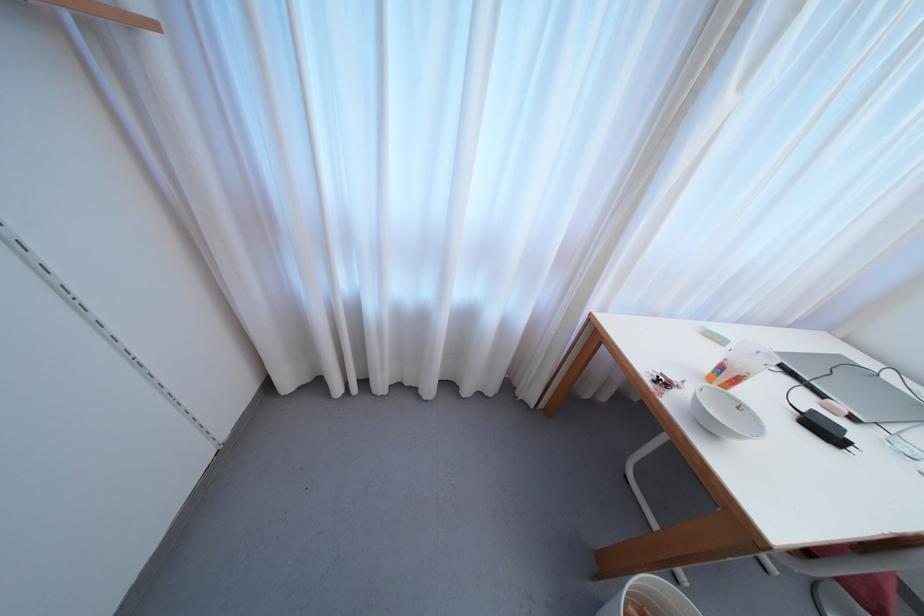
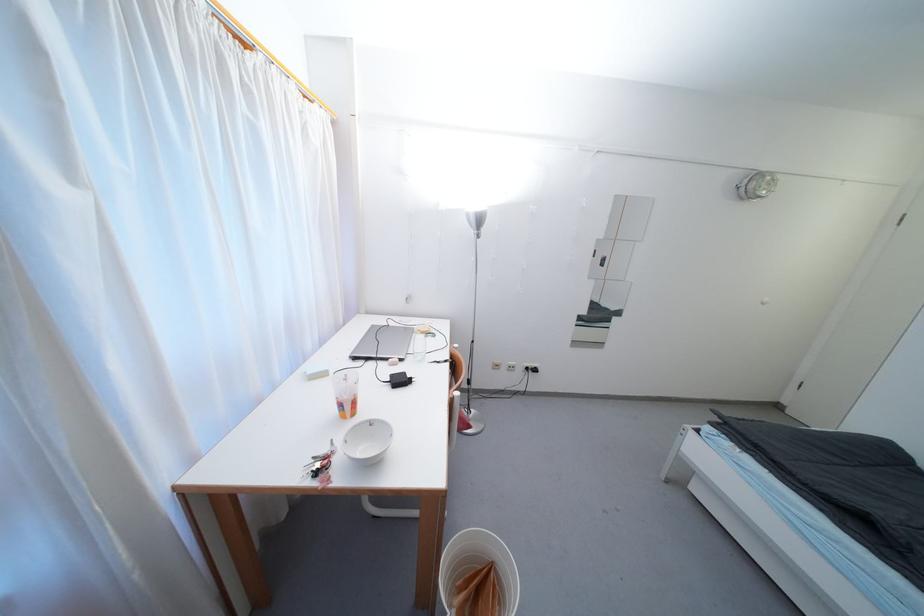
Find the pixel in the second image that matches pixel 847 432 in the first image.

(408, 376)